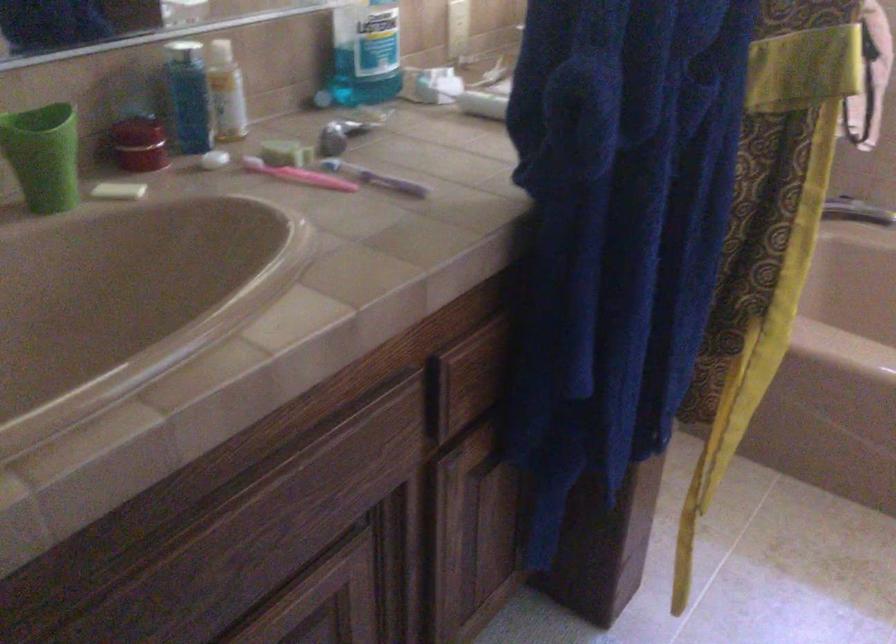
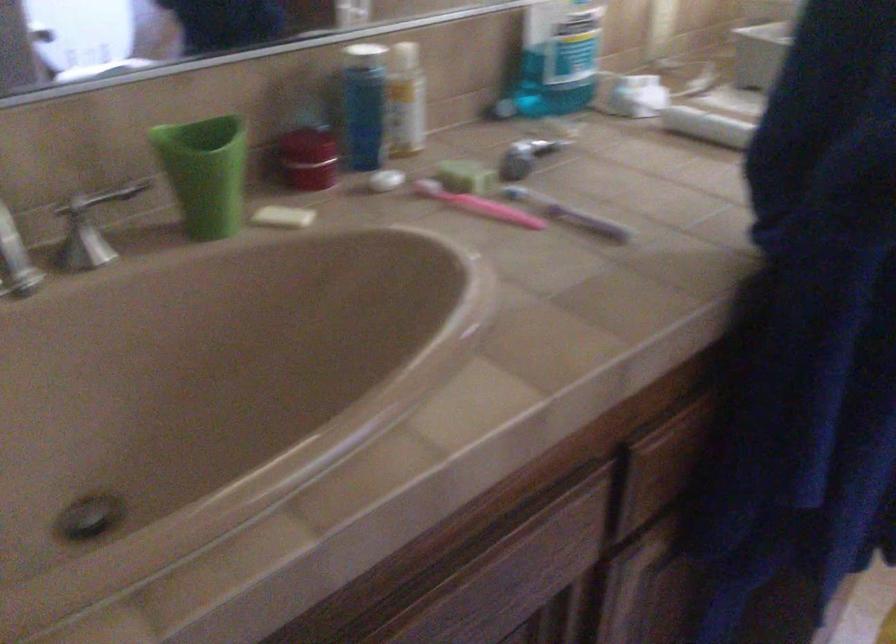
The images are taken continuously from a first-person perspective. In which direction are you moving?

The cameraman moved toward left, forward.